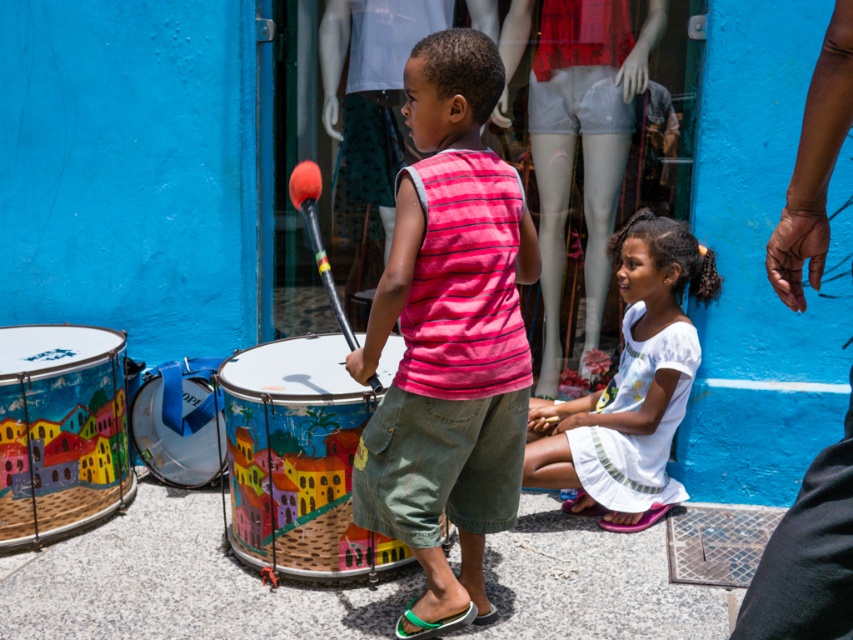
Between white cotton dress at lower center and metallic blue drum at lower left, which one appears on the left side from the viewer's perspective?

metallic blue drum at lower left

Which of these two, white cotton dress at lower center or metallic blue drum at lower left, stands shorter?

metallic blue drum at lower left is shorter.

Between point (645, 440) and point (216, 412), which one is positioned in front?

Point (645, 440)

This screenshot has width=853, height=640. I want to click on white cotton dress at lower center, so click(x=631, y=381).

Can you confirm if pink striped sleeveless shirt at center is positioned above metallic blue drum at lower left?

Yes.

Looking at this image, does pink striped sleeveless shirt at center have a smaller size compared to metallic blue drum at lower left?

Actually, pink striped sleeveless shirt at center might be larger than metallic blue drum at lower left.

What are the coordinates of `pink striped sleeveless shirt at center` in the screenshot? It's located at (450, 337).

Can you confirm if pink striped sleeveless shirt at center is positioned below painted wooden drum at center?

No.

Which of these two, pink striped sleeveless shirt at center or painted wooden drum at center, stands taller?

pink striped sleeveless shirt at center

Describe the element at coordinates (450, 337) in the screenshot. This screenshot has width=853, height=640. I see `pink striped sleeveless shirt at center` at that location.

Locate an element on the screen. The width and height of the screenshot is (853, 640). pink striped sleeveless shirt at center is located at coordinates (450, 337).